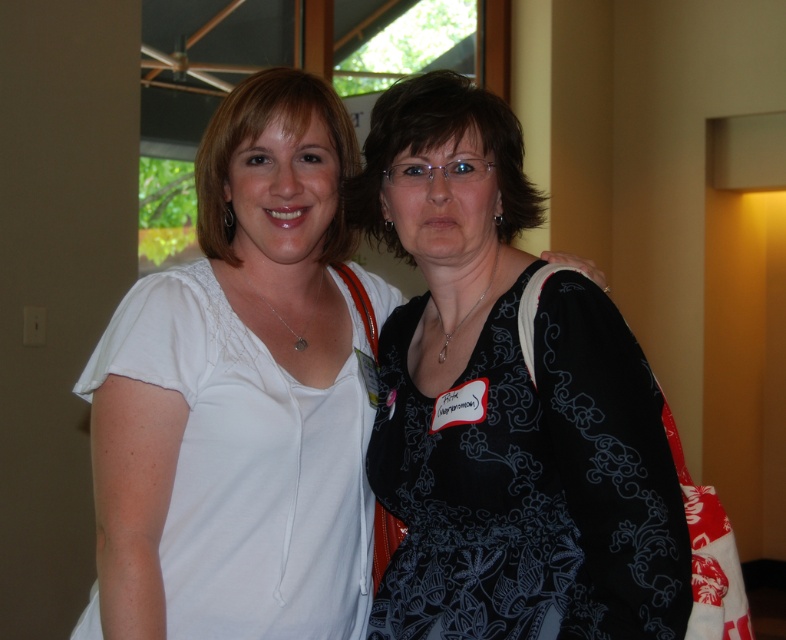
Which is more to the right, black printed dress at center or white matte shirt at left?

From the viewer's perspective, black printed dress at center appears more on the right side.

Who is more distant from viewer, (443, 580) or (127, 596)?

The point (443, 580) is behind.

Is point (608, 396) closer to camera compared to point (180, 356)?

That is True.

Identify the location of black printed dress at center. (505, 403).